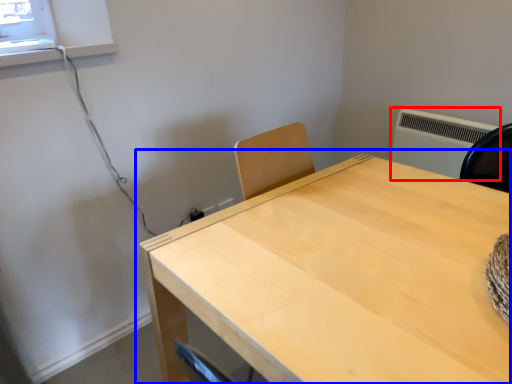
Question: Which of the following is the closest to the observer, air conditioning (highlighted by a red box) or table (highlighted by a blue box)?

Choices:
 (A) air conditioning
 (B) table

Answer: (B)